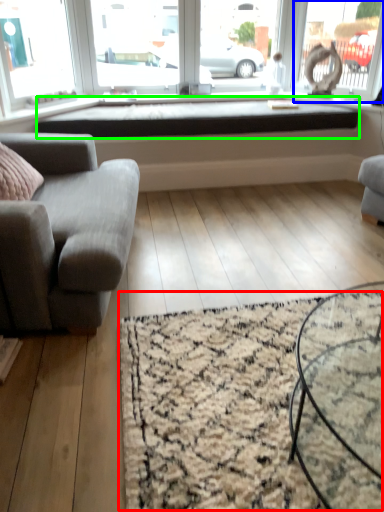
Question: Which object is positioned farthest from mat (highlighted by a red box)? Select from window (highlighted by a blue box) and window sill (highlighted by a green box).

Choices:
 (A) window
 (B) window sill

Answer: (A)